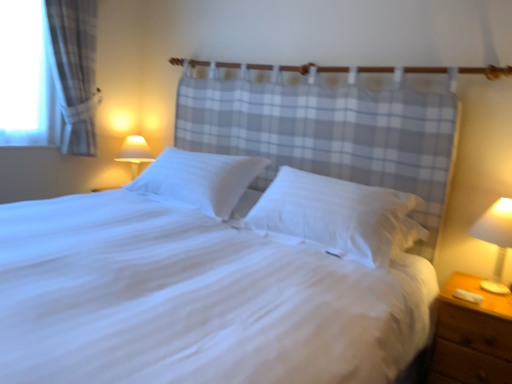
The image size is (512, 384). Describe the element at coordinates (193, 299) in the screenshot. I see `white smooth bed at center` at that location.

I want to click on white smooth bed at center, so click(x=193, y=299).

Is white smooth pillow at center, which appears as the 1th pillow when viewed from the left, far from brown wooden nightstand at lower right?

Yes.

Could you tell me if white smooth pillow at center, which appears as the 1th pillow when viewed from the left, is turned towards brown wooden nightstand at lower right?

No.

Can you confirm if white smooth pillow at center, which appears as the 1th pillow when viewed from the left, is taller than brown wooden nightstand at lower right?

Incorrect, the height of white smooth pillow at center, which appears as the 1th pillow when viewed from the left, is not larger of that of brown wooden nightstand at lower right.

From the picture: Is white smooth bed at center placed right next to white plastic lamp at right?

white smooth bed at center and white plastic lamp at right are not in contact.

Which is more to the right, white smooth bed at center or white plastic lamp at right?

white plastic lamp at right is more to the right.

Where is `bed that appears below the white plastic lamp at right (from a real-world perspective)`? This screenshot has width=512, height=384. bed that appears below the white plastic lamp at right (from a real-world perspective) is located at coordinates (193, 299).

Could you tell me if white smooth bed at center is facing white plastic lamp at right?

No, white smooth bed at center is not oriented towards white plastic lamp at right.

Considering the positions of objects matte white lampshade at upper left and white smooth pillow at center, acting as the second pillow starting from the right, in the image provided, who is more to the right, matte white lampshade at upper left or white smooth pillow at center, acting as the second pillow starting from the right,?

Positioned to the right is white smooth pillow at center, acting as the second pillow starting from the right.

Do you think matte white lampshade at upper left is within white smooth pillow at center, acting as the second pillow starting from the right, or outside of it?

matte white lampshade at upper left is located beyond the bounds of white smooth pillow at center, acting as the second pillow starting from the right.

Are matte white lampshade at upper left and white smooth pillow at center, which appears as the 1th pillow when viewed from the left, located far from each other?

Yes.

Is matte white lampshade at upper left wider than white smooth pillow at center, which appears as the 1th pillow when viewed from the left?

No.

Can you confirm if white smooth pillow at center, acting as the second pillow starting from the right, is positioned to the right of white plastic lamp at right?

No, white smooth pillow at center, acting as the second pillow starting from the right, is not to the right of white plastic lamp at right.

Identify the location of bedside lamp in front of the white smooth pillow at center, acting as the second pillow starting from the right. (496, 239).

From a real-world perspective, is white smooth pillow at center, which appears as the 1th pillow when viewed from the left, on top of white plastic lamp at right?

Correct, in the physical world, white smooth pillow at center, which appears as the 1th pillow when viewed from the left, is higher than white plastic lamp at right.

Considering the positions of objects white smooth pillow at center, acting as the second pillow starting from the right, and white plastic lamp at right in the image provided, who is in front, white smooth pillow at center, acting as the second pillow starting from the right, or white plastic lamp at right?

white plastic lamp at right is more forward.

From a real-world perspective, is white smooth bed at center on top of white soft pillow at center, which is the second pillow in left-to-right order?

No.

In the scene shown: From the image's perspective, who appears lower, white smooth bed at center or white soft pillow at center, which appears as the 1th pillow when viewed from the right?

white smooth bed at center appears lower in the image.

Is white smooth bed at center turned away from white soft pillow at center, which appears as the 1th pillow when viewed from the right?

Correct, white smooth bed at center is looking away from white soft pillow at center, which appears as the 1th pillow when viewed from the right.

Which is more distant, (319, 358) or (380, 238)?

Point (380, 238)

Can you confirm if brown wooden nightstand at lower right is wider than white soft pillow at center, which is the second pillow in left-to-right order?

Indeed, brown wooden nightstand at lower right has a greater width compared to white soft pillow at center, which is the second pillow in left-to-right order.

Does brown wooden nightstand at lower right come behind white soft pillow at center, which appears as the 1th pillow when viewed from the right?

No, brown wooden nightstand at lower right is closer to the camera.

Which is nearer, (507,326) or (355,232)?

Point (507,326) is closer to the camera than point (355,232).

From the image's perspective, which one is positioned higher, brown wooden nightstand at lower right or white soft pillow at center, which appears as the 1th pillow when viewed from the right?

white soft pillow at center, which appears as the 1th pillow when viewed from the right.

I want to click on nightstand that is under the white smooth bed at center (from a real-world perspective), so click(472, 336).

In the scene shown: Is brown wooden nightstand at lower right not within white smooth bed at center?

Actually, brown wooden nightstand at lower right is at least partially inside white smooth bed at center.

From a real-world perspective, is brown wooden nightstand at lower right physically located above or below white smooth bed at center?

From a real-world perspective, brown wooden nightstand at lower right is physically below white smooth bed at center.

Starting from the brown wooden nightstand at lower right, which pillow is the 2nd one behind? Please provide its 2D coordinates.

[(199, 179)]

Locate an element on the screen. The height and width of the screenshot is (384, 512). bed lying in front of the white plastic lamp at right is located at coordinates pos(193,299).

Estimate the real-world distances between objects in this image. Which object is closer to white smooth pillow at center, acting as the second pillow starting from the right, white plastic lamp at right or brown wooden nightstand at lower right?

Among the two, brown wooden nightstand at lower right is located nearer to white smooth pillow at center, acting as the second pillow starting from the right.

Which object lies nearer to the anchor point brown wooden nightstand at lower right, white plastic lamp at right or white soft pillow at center, which appears as the 1th pillow when viewed from the right?

Among the two, white plastic lamp at right is located nearer to brown wooden nightstand at lower right.

Based on their spatial positions, is white smooth pillow at center, which appears as the 1th pillow when viewed from the left, or brown wooden nightstand at lower right closer to white plastic lamp at right?

Based on the image, brown wooden nightstand at lower right appears to be nearer to white plastic lamp at right.

From the picture: From the image, which object appears to be nearer to brown wooden nightstand at lower right, white smooth bed at center or matte white lampshade at upper left?

white smooth bed at center.

Based on their spatial positions, is matte white lampshade at upper left or white soft pillow at center, which is the second pillow in left-to-right order, closer to white plastic lamp at right?

white soft pillow at center, which is the second pillow in left-to-right order.

Looking at the image, which one is located further to white plastic lamp at right, white soft pillow at center, which appears as the 1th pillow when viewed from the right, or matte white lampshade at upper left?

matte white lampshade at upper left.

Estimate the real-world distances between objects in this image. Which object is closer to white plastic lamp at right, white soft pillow at center, which appears as the 1th pillow when viewed from the right, or brown wooden nightstand at lower right?

Based on the image, brown wooden nightstand at lower right appears to be nearer to white plastic lamp at right.

Looking at the image, which one is located further to white soft pillow at center, which appears as the 1th pillow when viewed from the right, white plastic lamp at right or white smooth pillow at center, which appears as the 1th pillow when viewed from the left?

Among the two, white plastic lamp at right is located further to white soft pillow at center, which appears as the 1th pillow when viewed from the right.

Identify the location of bedside lamp located between white smooth bed at center and white soft pillow at center, which appears as the 1th pillow when viewed from the right, in the depth direction. (496, 239).

Identify the location of pillow between white smooth bed at center and white smooth pillow at center, acting as the second pillow starting from the right, in the front-back direction. This screenshot has width=512, height=384. (338, 216).

Locate an element on the screen. The width and height of the screenshot is (512, 384). nightstand located between white smooth bed at center and white smooth pillow at center, acting as the second pillow starting from the right, in the depth direction is located at coordinates (472, 336).

The image size is (512, 384). I want to click on nightstand between white smooth bed at center and matte white lampshade at upper left along the z-axis, so 472,336.